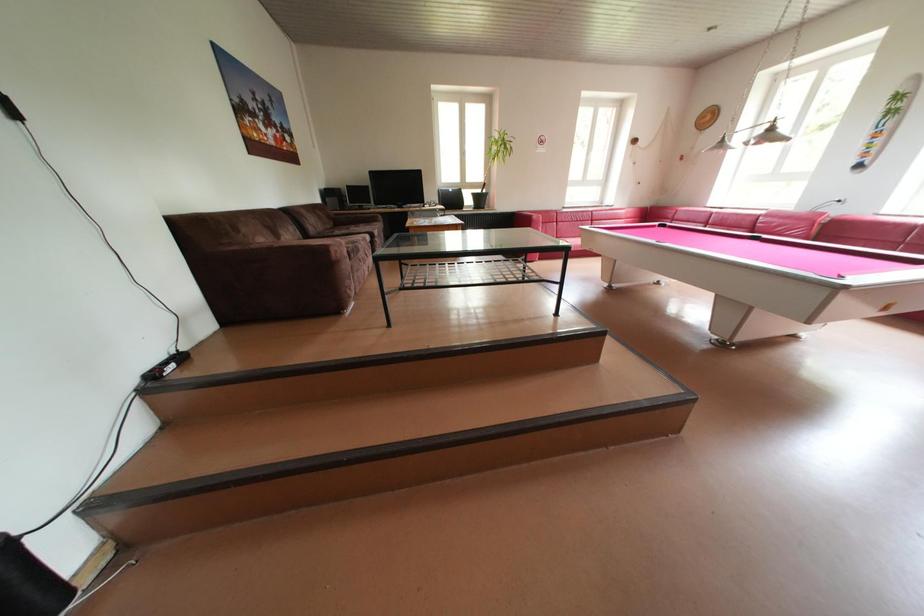
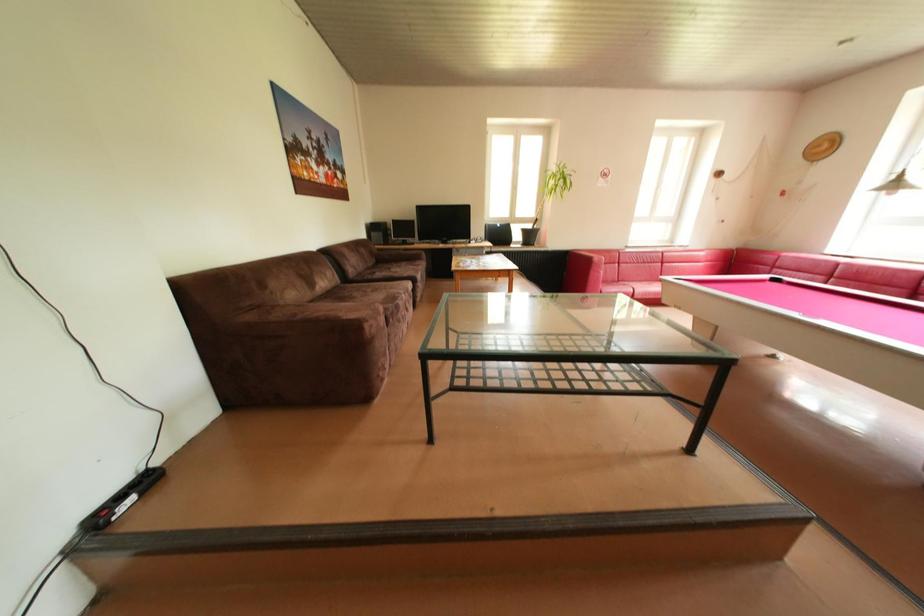
Question: The camera is either moving clockwise (left) or counter-clockwise (right) around the object. The first image is from the beginning of the video and the second image is from the end. Is the camera moving left or right when shooting the video?

Choices:
 (A) Left
 (B) Right

Answer: (B)